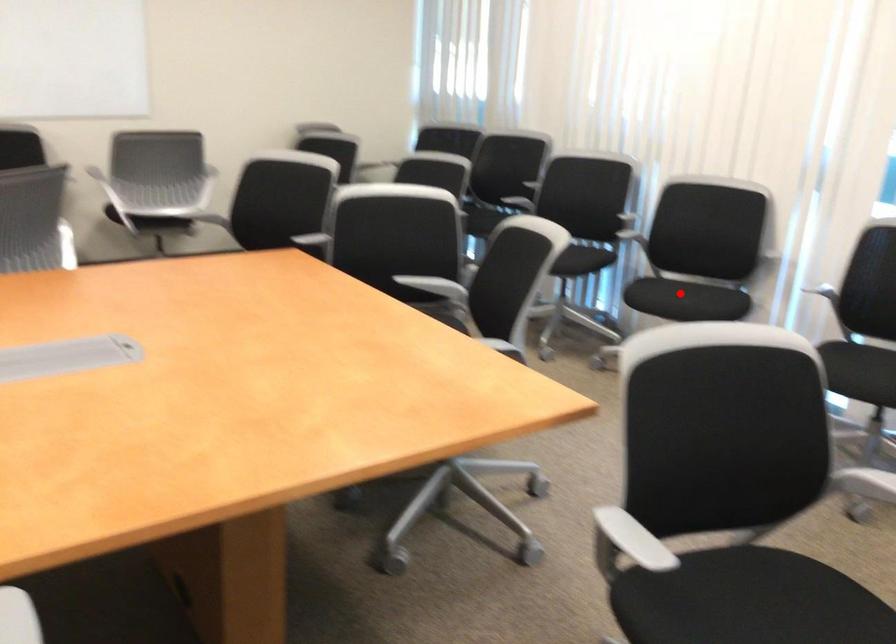
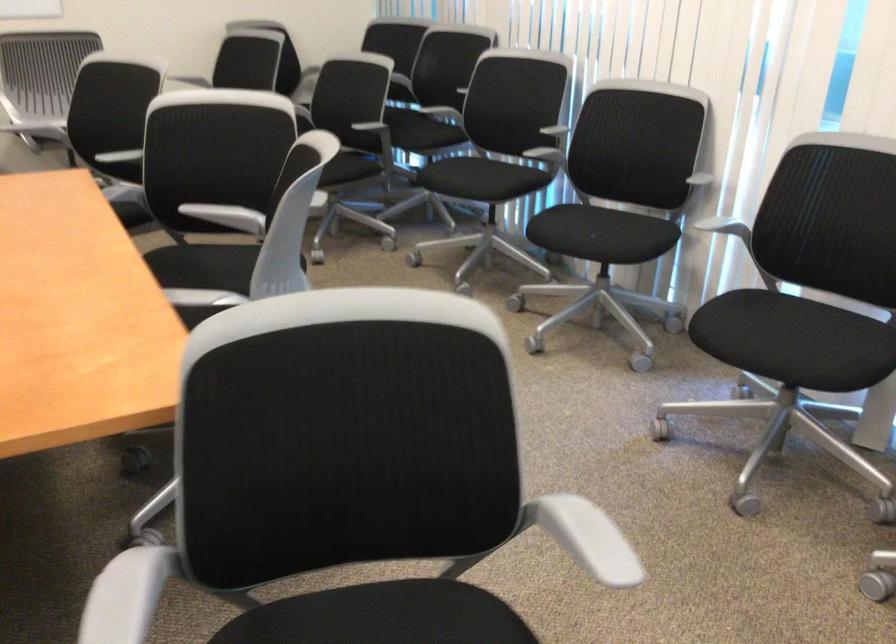
Where in the second image is the point corresponding to the highlighted location from the first image?

(582, 232)